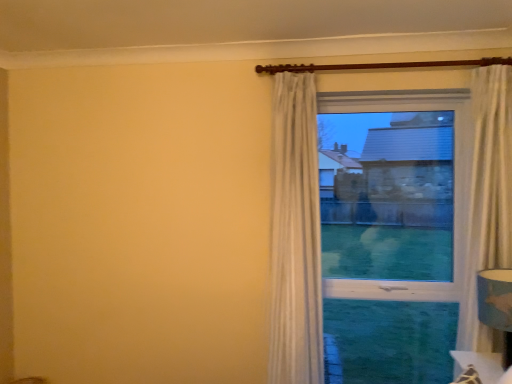
Question: Is white textured curtain at upper center taller than blue fabric lampshade at lower right?

Choices:
 (A) no
 (B) yes

Answer: (B)

Question: Is white textured curtain at upper center positioned with its back to blue fabric lampshade at lower right?

Choices:
 (A) yes
 (B) no

Answer: (B)

Question: From a real-world perspective, is white textured curtain at upper center on blue fabric lampshade at lower right?

Choices:
 (A) yes
 (B) no

Answer: (A)

Question: Is white textured curtain at upper center beside blue fabric lampshade at lower right?

Choices:
 (A) no
 (B) yes

Answer: (A)

Question: Considering the relative positions of white textured curtain at upper center and blue fabric lampshade at lower right in the image provided, is white textured curtain at upper center in front of blue fabric lampshade at lower right?

Choices:
 (A) no
 (B) yes

Answer: (A)

Question: Considering the positions of transparent glass window at center and white textured curtain at upper center in the image, is transparent glass window at center wider or thinner than white textured curtain at upper center?

Choices:
 (A) thin
 (B) wide

Answer: (A)

Question: Is transparent glass window at center to the left or to the right of white textured curtain at upper center in the image?

Choices:
 (A) left
 (B) right

Answer: (B)

Question: Considering the positions of transparent glass window at center and white textured curtain at upper center in the image, is transparent glass window at center bigger or smaller than white textured curtain at upper center?

Choices:
 (A) small
 (B) big

Answer: (A)

Question: Which is correct: transparent glass window at center is inside white textured curtain at upper center, or outside of it?

Choices:
 (A) outside
 (B) inside

Answer: (A)

Question: Is white textured curtain at upper center to the left or to the right of blue fabric lampshade at lower right in the image?

Choices:
 (A) left
 (B) right

Answer: (A)

Question: Choose the correct answer: Is white textured curtain at upper center inside blue fabric lampshade at lower right or outside it?

Choices:
 (A) outside
 (B) inside

Answer: (A)

Question: From the image's perspective, is white textured curtain at upper center above or below blue fabric lampshade at lower right?

Choices:
 (A) below
 (B) above

Answer: (B)

Question: From their relative heights in the image, would you say white textured curtain at upper center is taller or shorter than blue fabric lampshade at lower right?

Choices:
 (A) short
 (B) tall

Answer: (B)

Question: Is white textured curtain at upper center in front of or behind transparent glass window at center in the image?

Choices:
 (A) front
 (B) behind

Answer: (A)

Question: Is white textured curtain at upper center situated inside transparent glass window at center or outside?

Choices:
 (A) outside
 (B) inside

Answer: (A)